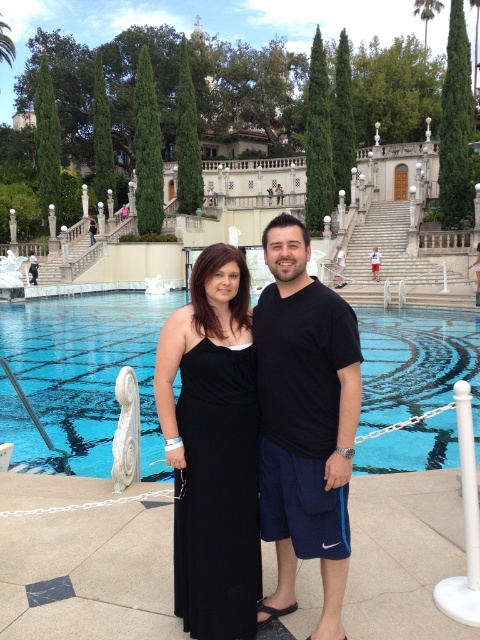
Question: Which point appears closest to the camera in this image?

Choices:
 (A) (344, 483)
 (B) (241, 625)
 (C) (442, 323)

Answer: (B)

Question: Does black cotton t-shirt at center have a smaller size compared to black satin dress at center?

Choices:
 (A) no
 (B) yes

Answer: (A)

Question: In this image, where is black cotton t-shirt at center located relative to black satin dress at center?

Choices:
 (A) above
 (B) below

Answer: (A)

Question: Which object appears closest to the camera in this image?

Choices:
 (A) black satin dress at center
 (B) blue glass swimming pool at center
 (C) black cotton t-shirt at center

Answer: (C)

Question: Can you confirm if blue glass swimming pool at center is positioned above black cotton t-shirt at center?

Choices:
 (A) no
 (B) yes

Answer: (B)

Question: Among these objects, which one is nearest to the camera?

Choices:
 (A) blue glass swimming pool at center
 (B) black cotton t-shirt at center
 (C) black satin dress at center

Answer: (B)